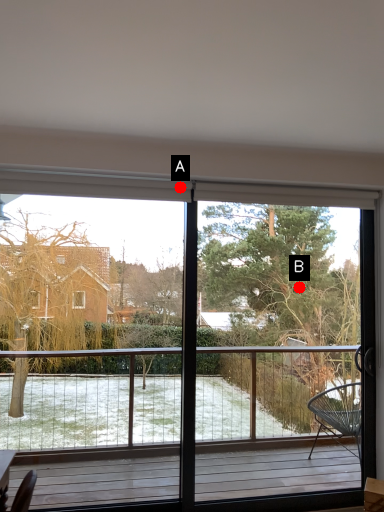
Question: Two points are circled on the image, labeled by A and B beside each circle. Which point is further to the camera?

Choices:
 (A) A is further
 (B) B is further

Answer: (B)